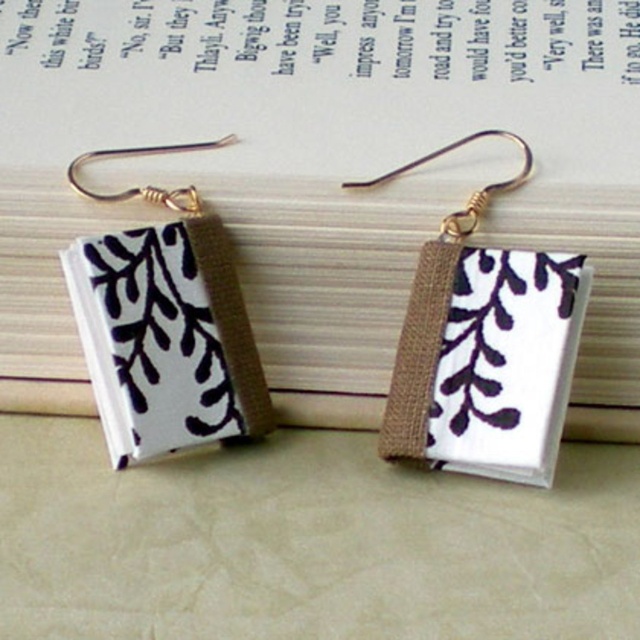
Question: Is white fabric book at center further to camera compared to white fabric book at left?

Choices:
 (A) no
 (B) yes

Answer: (A)

Question: Which of the following is the farthest from the observer?

Choices:
 (A) (116, 444)
 (B) (316, 228)

Answer: (B)

Question: Among these objects, which one is nearest to the camera?

Choices:
 (A) white fabric book at center
 (B) white fabric book at left

Answer: (A)

Question: From the image, what is the correct spatial relationship of white fabric book at center in relation to white fabric book at left?

Choices:
 (A) right
 (B) left

Answer: (A)

Question: Can you confirm if white fabric book at center is thinner than white fabric book at left?

Choices:
 (A) yes
 (B) no

Answer: (B)

Question: Which of the following is the closest to the observer?

Choices:
 (A) (141, 260)
 (B) (609, 164)

Answer: (B)